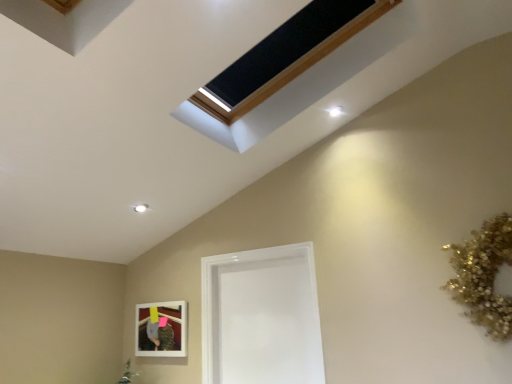
This screenshot has height=384, width=512. Describe the element at coordinates (161, 329) in the screenshot. I see `matte white picture frame at lower left` at that location.

I want to click on matte white picture frame at lower left, so click(161, 329).

This screenshot has height=384, width=512. What do you see at coordinates (261, 317) in the screenshot? I see `transparent glass door at center` at bounding box center [261, 317].

Where is `transparent glass door at center`? The image size is (512, 384). transparent glass door at center is located at coordinates (261, 317).

This screenshot has width=512, height=384. Identify the location of matte white picture frame at lower left. (161, 329).

Which object is positioned more to the left, matte white picture frame at lower left or transparent glass door at center?

From the viewer's perspective, matte white picture frame at lower left appears more on the left side.

Is matte white picture frame at lower left in front of or behind transparent glass door at center in the image?

matte white picture frame at lower left is positioned farther from the viewer than transparent glass door at center.

Considering the points (152, 338) and (275, 248), which point is in front, point (152, 338) or point (275, 248)?

The point (275, 248) is closer.

From the image's perspective, is matte white picture frame at lower left positioned above or below transparent glass door at center?

Based on their image positions, matte white picture frame at lower left is located beneath transparent glass door at center.

From a real-world perspective, is matte white picture frame at lower left positioned over transparent glass door at center based on gravity?

No.

Is matte white picture frame at lower left wider or thinner than transparent glass door at center?

Considering their sizes, matte white picture frame at lower left looks slimmer than transparent glass door at center.

Which of these two, matte white picture frame at lower left or transparent glass door at center, stands taller?

transparent glass door at center.

Between matte white picture frame at lower left and transparent glass door at center, which one has smaller size?

With smaller size is matte white picture frame at lower left.

Is transparent glass door at center a part of matte white picture frame at lower left?

No, matte white picture frame at lower left does not contain transparent glass door at center.

In the scene shown: Are matte white picture frame at lower left and transparent glass door at center beside each other?

matte white picture frame at lower left is not next to transparent glass door at center, and they're not touching.

Is matte white picture frame at lower left facing away from transparent glass door at center?

No, transparent glass door at center is not at the back of matte white picture frame at lower left.

How different are the orientations of matte white picture frame at lower left and transparent glass door at center in degrees?

0.264 degrees separate the facing orientations of matte white picture frame at lower left and transparent glass door at center.

Measure the distance from matte white picture frame at lower left to transparent glass door at center.

A distance of 21.18 inches exists between matte white picture frame at lower left and transparent glass door at center.

The image size is (512, 384). What are the coordinates of `glass door located on the right of matte white picture frame at lower left` in the screenshot? It's located at (261, 317).

Is transparent glass door at center at the right side of matte white picture frame at lower left?

Correct, you'll find transparent glass door at center to the right of matte white picture frame at lower left.

Considering their positions, is transparent glass door at center located in front of or behind matte white picture frame at lower left?

Visually, transparent glass door at center is located in front of matte white picture frame at lower left.

Which is closer, (x=238, y=375) or (x=174, y=337)?

Point (x=238, y=375) is positioned closer to the camera compared to point (x=174, y=337).

From the image's perspective, is transparent glass door at center located above or below matte white picture frame at lower left?

transparent glass door at center is above matte white picture frame at lower left.

From a real-world perspective, which is physically above, transparent glass door at center or matte white picture frame at lower left?

transparent glass door at center is physically above.

Which object is wider, transparent glass door at center or matte white picture frame at lower left?

Wider between the two is transparent glass door at center.

From the picture: Does transparent glass door at center have a greater height compared to matte white picture frame at lower left?

Indeed, transparent glass door at center has a greater height compared to matte white picture frame at lower left.

Based on the photo, does transparent glass door at center have a larger size compared to matte white picture frame at lower left?

Yes, transparent glass door at center is bigger than matte white picture frame at lower left.

Choose the correct answer: Is transparent glass door at center inside matte white picture frame at lower left or outside it?

transparent glass door at center is not inside matte white picture frame at lower left, it's outside.

Is transparent glass door at center not close to matte white picture frame at lower left?

No, transparent glass door at center is not far from matte white picture frame at lower left.

Could you tell me if transparent glass door at center is facing matte white picture frame at lower left?

No.

In order to click on picture frame that is on the left side of transparent glass door at center in this screenshot , I will do `click(161, 329)`.

Find the location of a particular element. This screenshot has height=384, width=512. picture frame on the left of transparent glass door at center is located at coordinates tap(161, 329).

Identify the location of glass door on the right of matte white picture frame at lower left. The image size is (512, 384). (261, 317).